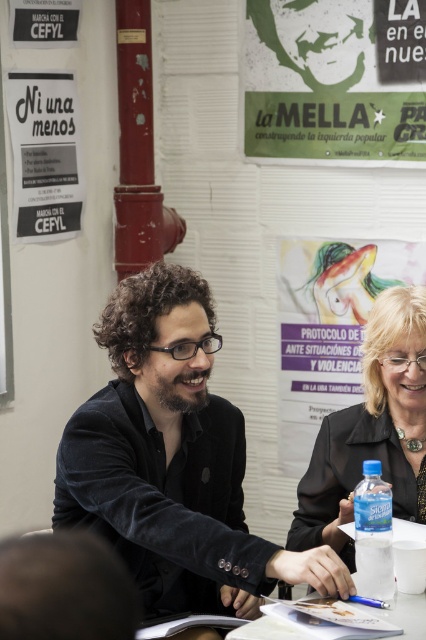
Question: Does green paper poster at upper center come in front of black leather jacket at right?

Choices:
 (A) yes
 (B) no

Answer: (B)

Question: Which of the following is the farthest from the observer?

Choices:
 (A) (408, 144)
 (B) (388, 557)

Answer: (A)

Question: Does green paper poster at upper center appear under clear plastic bottle at lower right?

Choices:
 (A) yes
 (B) no

Answer: (B)

Question: Which of the following is the farthest from the observer?

Choices:
 (A) green paper poster at upper center
 (B) white paper poster at upper left

Answer: (A)

Question: Among these objects, which one is nearest to the camera?

Choices:
 (A) green paper poster at upper center
 (B) clear plastic bottle at lower right
 (C) black leather jacket at right
 (D) white paper poster at upper left

Answer: (B)

Question: Is green paper poster at upper center wider than white paper poster at upper left?

Choices:
 (A) yes
 (B) no

Answer: (A)